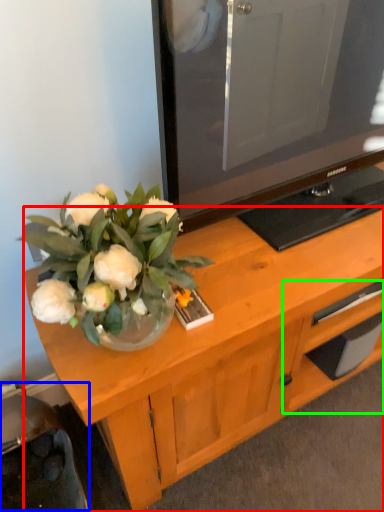
Question: Considering the real-world distances, which object is closest to desk (highlighted by a red box)? swivel chair (highlighted by a blue box) or drawer (highlighted by a green box).

Choices:
 (A) swivel chair
 (B) drawer

Answer: (B)